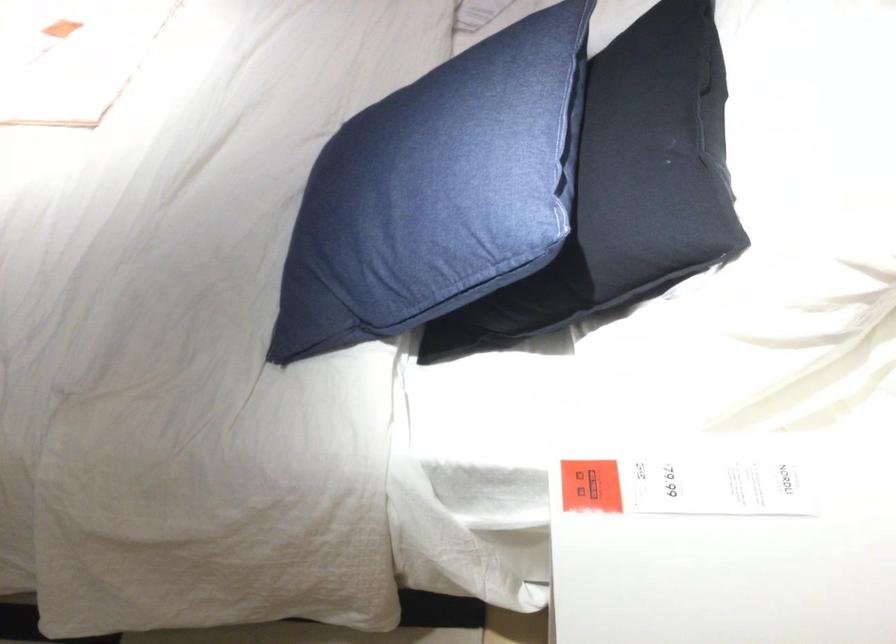
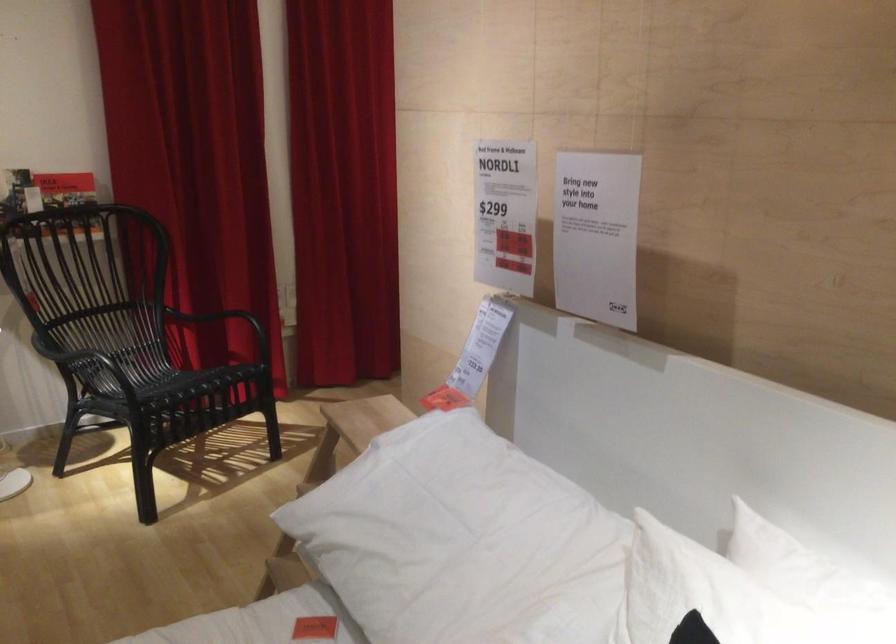
First-person continuous shooting, in which direction is the camera rotating?

The camera rotated toward right-up.